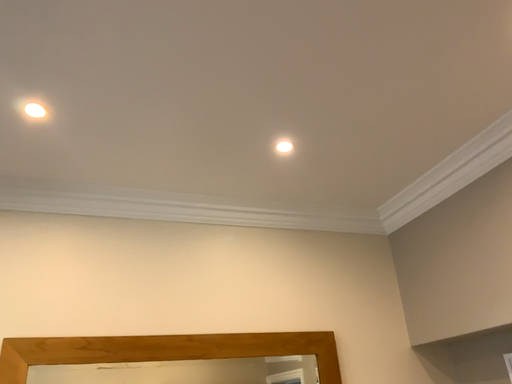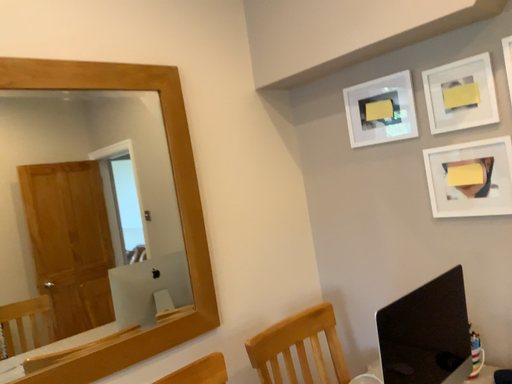
Question: Which way did the camera rotate in the video?

Choices:
 (A) rotated left
 (B) rotated right

Answer: (B)